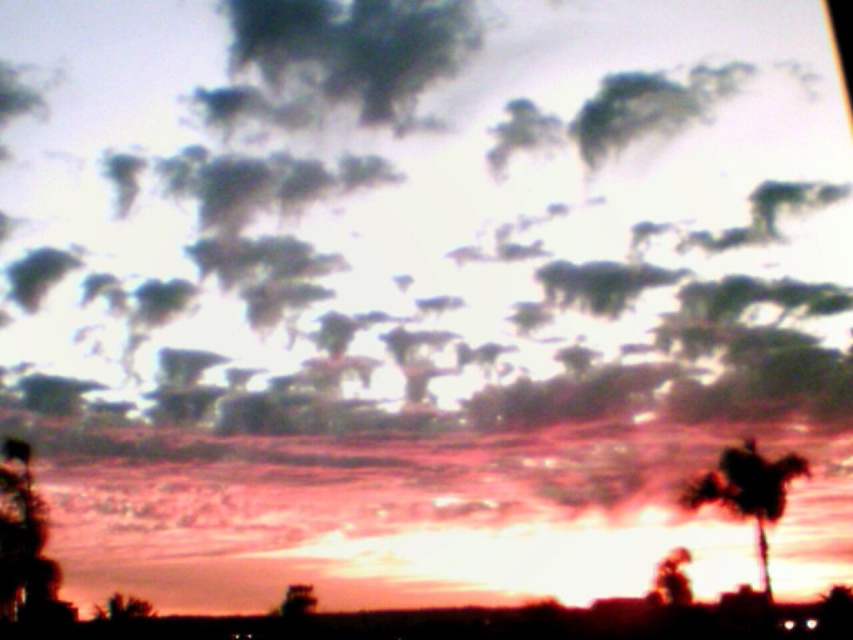
You are standing in the sunset scene and want to take a photo. There are two points marked in the image, point 1 at coordinates point (790, 17) and point 2 at point (700, 476). Which point is closer to you?

Point (790, 17) is closer to the camera than point (700, 476), so the point closer to you is point (790, 17).

You are an artist trying to paint the sunset scene. You want to ensure the white fluffy cloud at upper center and the silhouette leafy palm at right are proportionally accurate. Which object should you paint larger?

The white fluffy cloud at upper center should be painted larger than the silhouette leafy palm at right because it is larger in size according to the description.

You are an artist trying to paint the sunset scene. You want to place a small bird between the white fluffy cloud at upper center and the silhouette leafy palm at right. Which object should the bird be closer to?

The white fluffy cloud at upper center is positioned on the left side of silhouette leafy palm at right, so the bird should be placed closer to the white fluffy cloud at upper center to maintain balance in the composition.